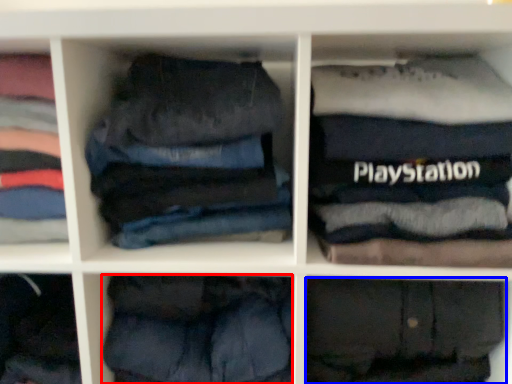
Question: Which object is further to the camera taking this photo, trousers (highlighted by a red box) or trousers (highlighted by a blue box)?

Choices:
 (A) trousers
 (B) trousers

Answer: (A)